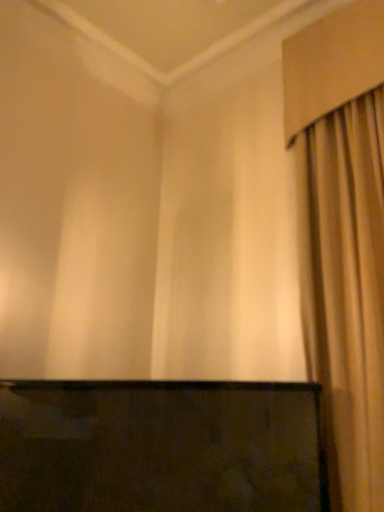
Image resolution: width=384 pixels, height=512 pixels. Describe the element at coordinates (345, 291) in the screenshot. I see `beige fabric curtain at right` at that location.

Locate an element on the screen. This screenshot has height=512, width=384. beige fabric curtain at right is located at coordinates (345, 291).

The image size is (384, 512). I want to click on beige fabric curtain at right, so click(x=345, y=291).